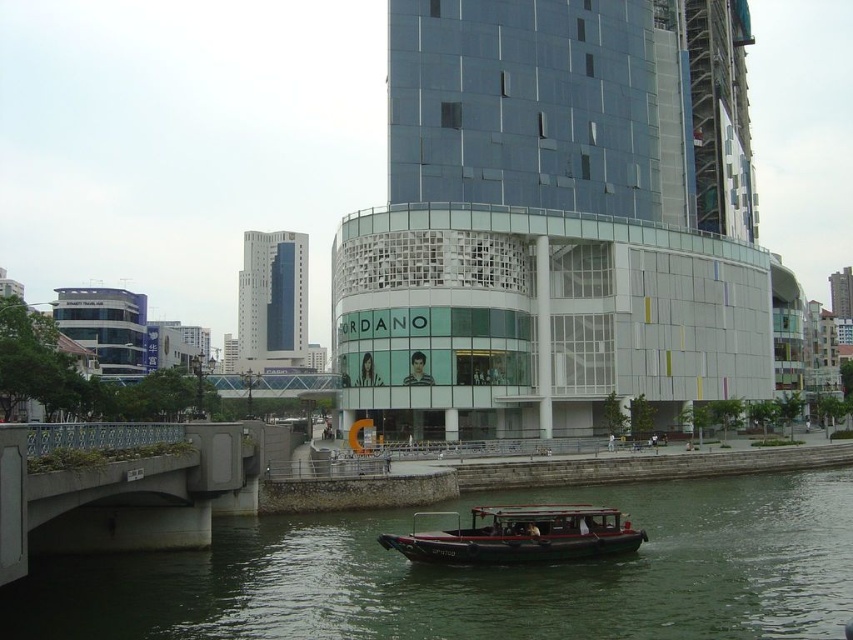
Which is more to the right, glassy metallic building at center or concrete bridge at lower left?

glassy metallic building at center

Describe the element at coordinates (554, 221) in the screenshot. The height and width of the screenshot is (640, 853). I see `glassy metallic building at center` at that location.

Locate an element on the screen. Image resolution: width=853 pixels, height=640 pixels. glassy metallic building at center is located at coordinates (554, 221).

Find the location of a particular element. glassy metallic building at center is located at coordinates (554, 221).

Who is shorter, greenish water at lower center or glassy blue skyscraper at upper left?

greenish water at lower center

Is greenish water at lower center in front of glassy blue skyscraper at upper left?

That is True.

Is point (218, 618) behind point (248, 349)?

No, (218, 618) is in front of (248, 349).

Locate an element on the screen. greenish water at lower center is located at coordinates (479, 576).

Between glassy metallic building at center and greenish water at lower center, which one has more height?

glassy metallic building at center is taller.

Is glassy metallic building at center to the left of greenish water at lower center from the viewer's perspective?

No, glassy metallic building at center is not to the left of greenish water at lower center.

Is point (422, 90) more distant than point (685, 570)?

Yes, it is.

This screenshot has height=640, width=853. I want to click on glassy metallic building at center, so click(x=554, y=221).